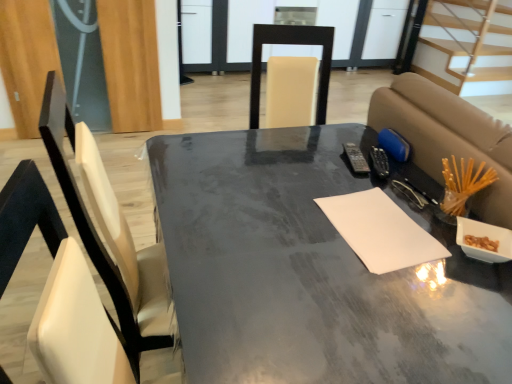
This screenshot has width=512, height=384. I want to click on vacant space underneath white paper at center (from a real-world perspective), so click(380, 229).